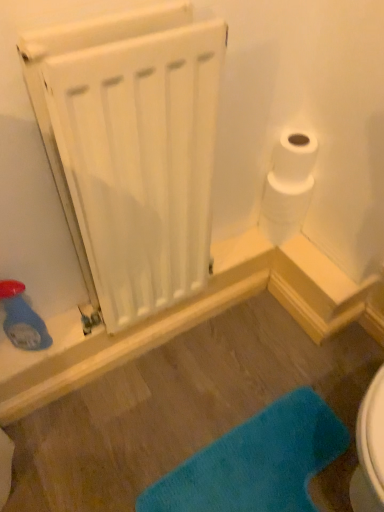
At what (x,y) coordinates should I click in order to perform the action: click on blank space situated above white matte radiator at upper left (from a real-world perspective). Please return your answer as a coordinate pair (x, y). Image resolution: width=384 pixels, height=512 pixels. Looking at the image, I should click on (94, 16).